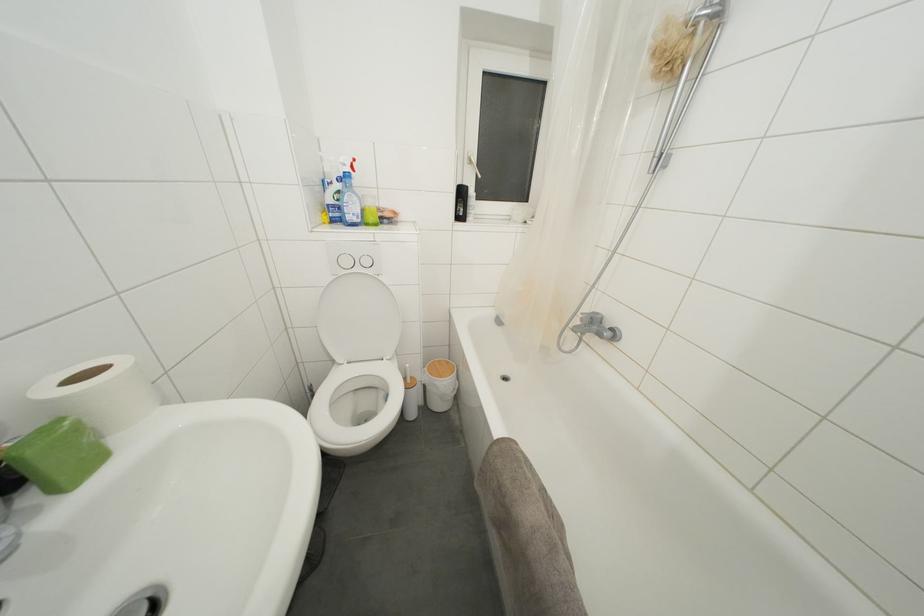
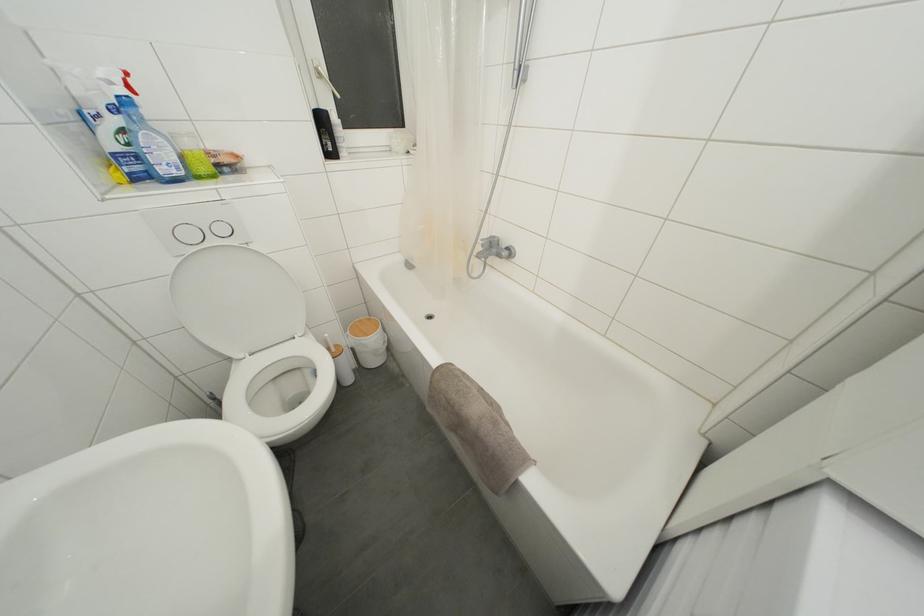
Locate, in the second image, the point that corresponds to point 466,198 in the first image.

(325, 126)